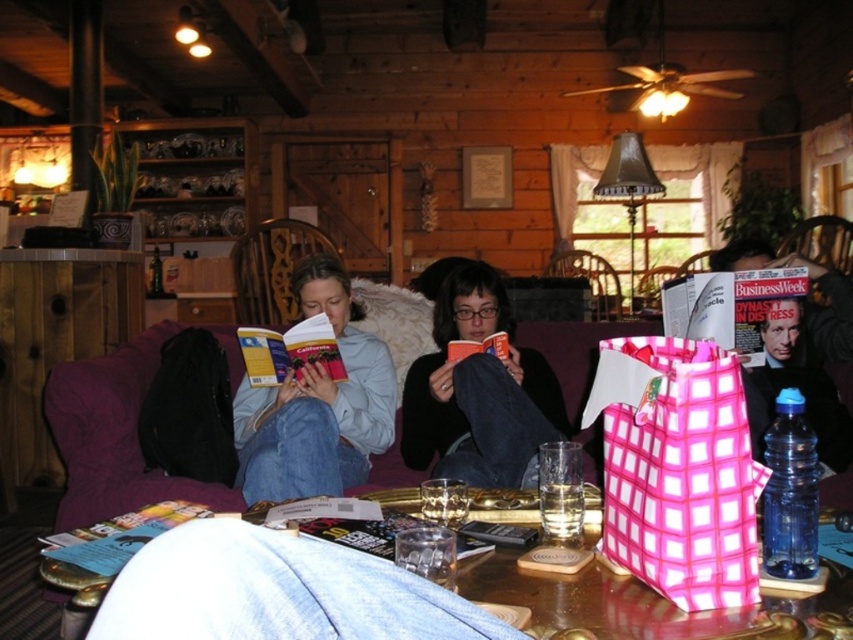
Measure the distance between denim jacket at center and camera.

denim jacket at center and camera are 5.69 feet apart.

Between denim jacket at center and matte blue armchair at center, which one has less height?

Standing shorter between the two is matte blue armchair at center.

Between point (396, 385) and point (280, 221), which one is positioned in front?

Point (396, 385) is more forward.

Locate an element on the screen. The height and width of the screenshot is (640, 853). denim jacket at center is located at coordinates (317, 404).

In the scene shown: Does matte blue armchair at center have a smaller size compared to pink checkered fabric armchair at center?

No, matte blue armchair at center is not smaller than pink checkered fabric armchair at center.

Who is more distant from viewer, (309,248) or (556,259)?

Positioned behind is point (556,259).

Between point (303, 243) and point (558, 266), which one is positioned behind?

Point (558, 266)

Locate an element on the screen. This screenshot has width=853, height=640. matte blue armchair at center is located at coordinates 271,269.

Does point (709, 337) come behind point (578, 262)?

No, (709, 337) is in front of (578, 262).

Between matte paper magazine at center right and pink checkered fabric armchair at center, which one has less height?

With less height is matte paper magazine at center right.

Who is more distant from viewer, (773, 300) or (556, 268)?

Positioned behind is point (556, 268).

This screenshot has height=640, width=853. Identify the location of matte paper magazine at center right. (729, 307).